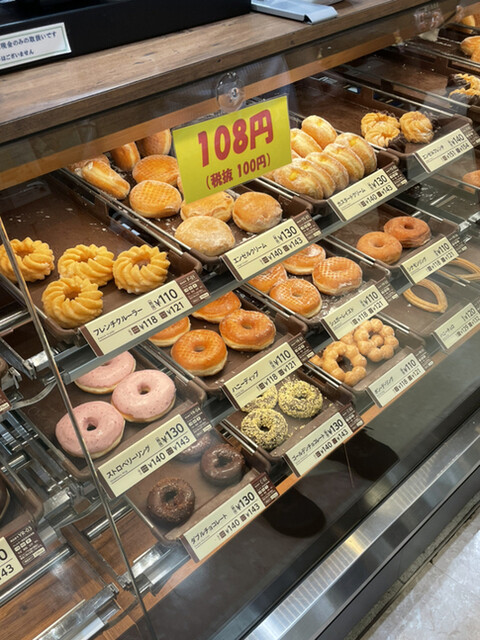
The height and width of the screenshot is (640, 480). In order to click on wooden counter top in this screenshot , I will do `click(170, 54)`.